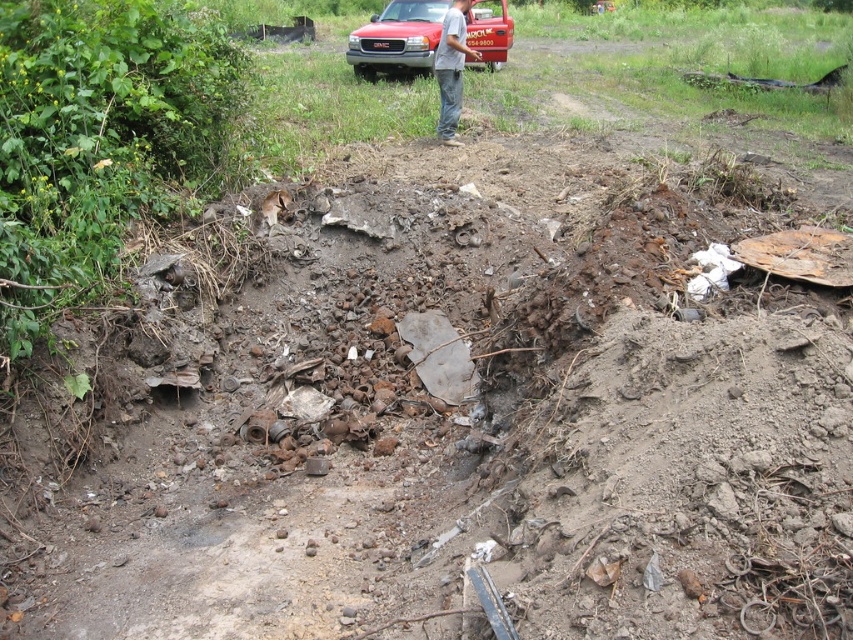
Question: Is matte red truck at upper center above gray jeans at center?

Choices:
 (A) no
 (B) yes

Answer: (B)

Question: Which of the following is the closest to the observer?

Choices:
 (A) matte red truck at upper center
 (B) gray jeans at center

Answer: (B)

Question: Which of the following is the closest to the observer?

Choices:
 (A) matte red truck at upper center
 (B) gray jeans at center

Answer: (B)

Question: Does matte red truck at upper center appear on the left side of gray jeans at center?

Choices:
 (A) yes
 (B) no

Answer: (A)

Question: Does matte red truck at upper center have a lesser width compared to gray jeans at center?

Choices:
 (A) no
 (B) yes

Answer: (A)